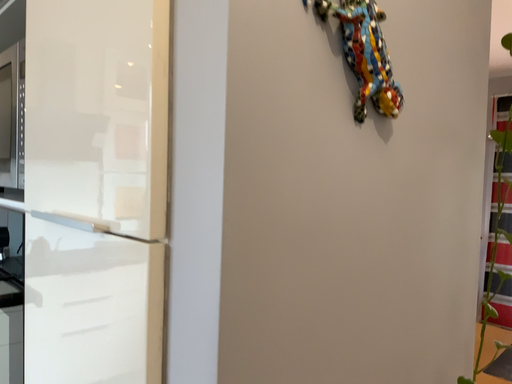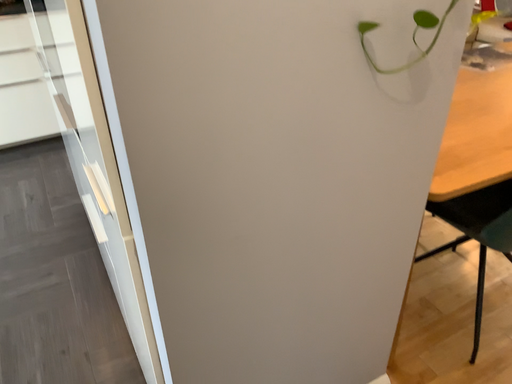
Question: How did the camera likely rotate when shooting the video?

Choices:
 (A) rotated left
 (B) rotated right

Answer: (A)